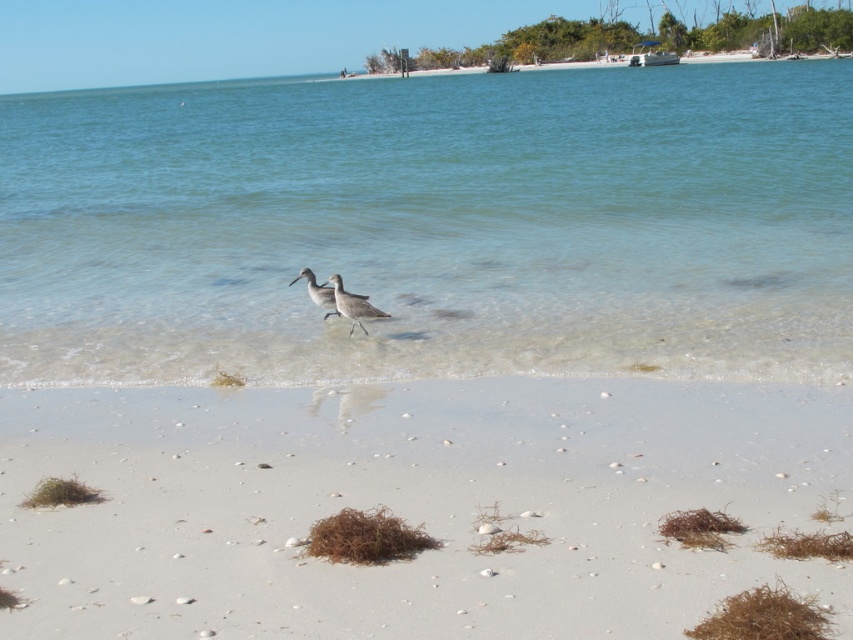
Question: Can you confirm if white sandy beach at lower center is positioned to the left of gray matte bird at center?

Choices:
 (A) yes
 (B) no

Answer: (B)

Question: Is clear water at center in front of white sandy beach at lower center?

Choices:
 (A) yes
 (B) no

Answer: (B)

Question: Is brown speckled sandpiper at center thinner than gray matte bird at center?

Choices:
 (A) no
 (B) yes

Answer: (B)

Question: Which object is the closest to the clear water at center?

Choices:
 (A) gray matte bird at center
 (B) brown speckled sandpiper at center
 (C) white sandy beach at lower center

Answer: (C)

Question: Which object appears farthest from the camera in this image?

Choices:
 (A) white sandy beach at lower center
 (B) gray matte bird at center
 (C) brown speckled sandpiper at center
 (D) clear water at center

Answer: (B)

Question: Which object is positioned closest to the brown speckled sandpiper at center?

Choices:
 (A) gray matte bird at center
 (B) clear water at center

Answer: (A)